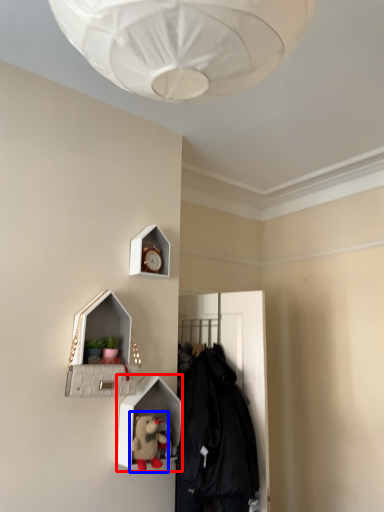
Question: Which object appears farthest to the camera in this image, shelf (highlighted by a red box) or toy (highlighted by a blue box)?

Choices:
 (A) shelf
 (B) toy

Answer: (A)